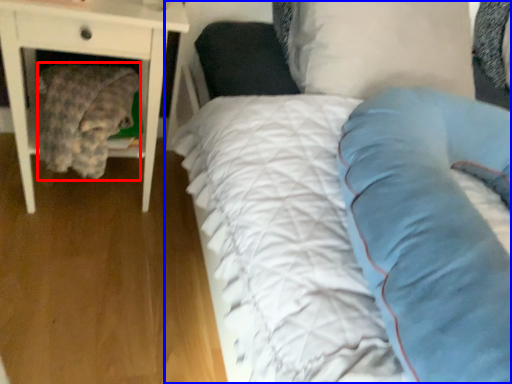
Question: Which of the following is the closest to the observer, material (highlighted by a red box) or bed (highlighted by a blue box)?

Choices:
 (A) material
 (B) bed

Answer: (B)